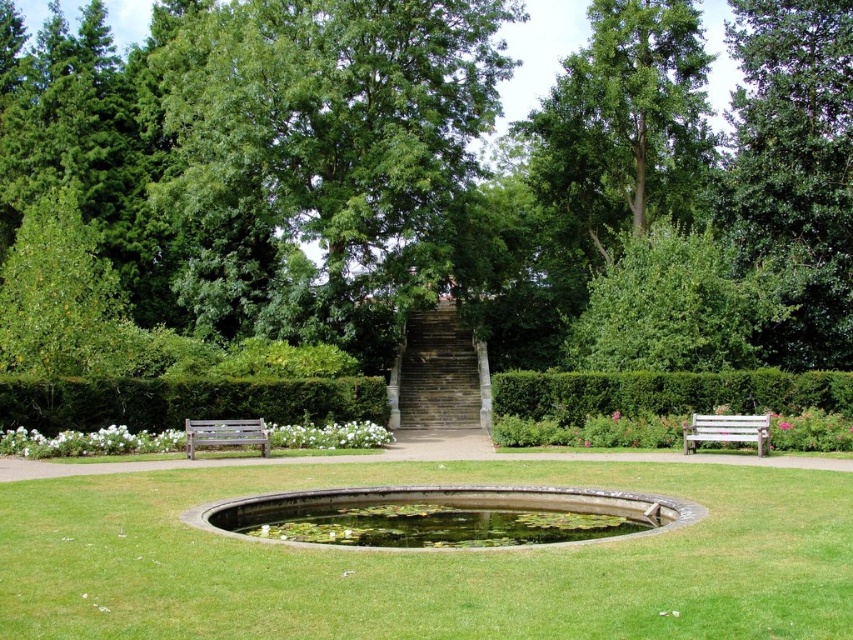
Question: Can you confirm if green leafy tree at center is thinner than green grassy at center?

Choices:
 (A) yes
 (B) no

Answer: (B)

Question: Does green leafy tree at center have a larger size compared to wooden park bench at lower left?

Choices:
 (A) no
 (B) yes

Answer: (B)

Question: Among these points, which one is farthest from the camera?

Choices:
 (A) (500, 572)
 (B) (543, 291)
 (C) (392, 518)
 (D) (747, 433)

Answer: (B)

Question: Which object appears closest to the camera in this image?

Choices:
 (A) wooden park bench at lower left
 (B) clear glass water at center

Answer: (B)

Question: Can you confirm if green grassy at center is positioned below white wooden bench at right?

Choices:
 (A) no
 (B) yes

Answer: (B)

Question: Which of these objects is positioned closest to the green leafy bush at upper right?

Choices:
 (A) wooden park bench at lower left
 (B) green leafy hedge at left
 (C) green grassy at center

Answer: (B)